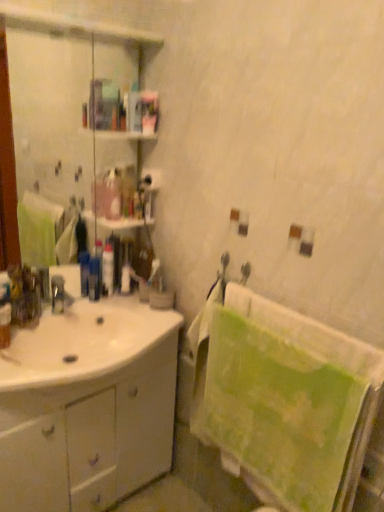
Question: Is blue plastic toothbrush at center, the 1th toiletry viewed from the left, turned away from white matte toilet paper at upper center?

Choices:
 (A) yes
 (B) no

Answer: (B)

Question: Does blue plastic toothbrush at center, which ranks as the 3th toiletry in right-to-left order, come behind white matte toilet paper at upper center?

Choices:
 (A) no
 (B) yes

Answer: (B)

Question: Can you confirm if blue plastic toothbrush at center, the 1th toiletry viewed from the left, is wider than white matte toilet paper at upper center?

Choices:
 (A) yes
 (B) no

Answer: (A)

Question: Does blue plastic toothbrush at center, the 1th toiletry viewed from the left, have a smaller size compared to white matte toilet paper at upper center?

Choices:
 (A) no
 (B) yes

Answer: (A)

Question: Is blue plastic toothbrush at center, which ranks as the 3th toiletry in right-to-left order, bigger than white matte toilet paper at upper center?

Choices:
 (A) no
 (B) yes

Answer: (B)

Question: Could you tell me if blue plastic toothbrush at center, which ranks as the 3th toiletry in right-to-left order, is facing white matte toilet paper at upper center?

Choices:
 (A) yes
 (B) no

Answer: (B)

Question: Considering the relative sizes of blue plastic toothbrush at center, the 1th toiletry viewed from the left, and white glossy sink at lower left in the image provided, is blue plastic toothbrush at center, the 1th toiletry viewed from the left, wider than white glossy sink at lower left?

Choices:
 (A) no
 (B) yes

Answer: (A)

Question: From a real-world perspective, is blue plastic toothbrush at center, which ranks as the 3th toiletry in right-to-left order, located beneath white glossy sink at lower left?

Choices:
 (A) yes
 (B) no

Answer: (B)

Question: Does blue plastic toothbrush at center, which ranks as the 3th toiletry in right-to-left order, appear on the left side of white glossy sink at lower left?

Choices:
 (A) yes
 (B) no

Answer: (B)

Question: Is blue plastic toothbrush at center, which ranks as the 3th toiletry in right-to-left order, not within white glossy sink at lower left?

Choices:
 (A) yes
 (B) no

Answer: (A)

Question: Is blue plastic toothbrush at center, the 1th toiletry viewed from the left, aimed at white glossy sink at lower left?

Choices:
 (A) no
 (B) yes

Answer: (B)

Question: Is blue plastic toothbrush at center, the 1th toiletry viewed from the left, taller than white glossy sink at lower left?

Choices:
 (A) no
 (B) yes

Answer: (A)

Question: Is green textured towel at right taller than white matte toilet paper at upper center?

Choices:
 (A) yes
 (B) no

Answer: (A)